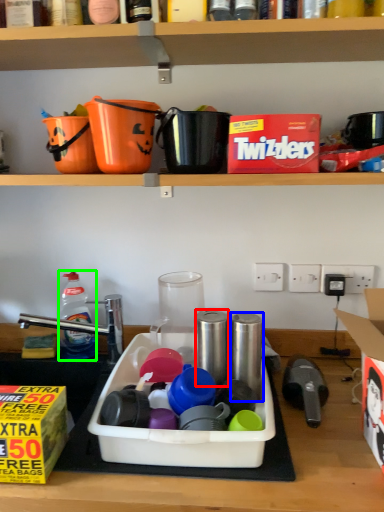
Question: Which is nearer to the appliance (highlighted by a red box)? appliance (highlighted by a blue box) or bottle (highlighted by a green box).

Choices:
 (A) appliance
 (B) bottle

Answer: (A)